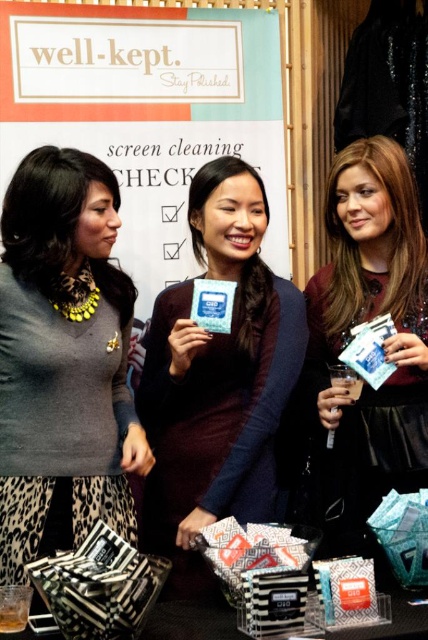
Question: Among these objects, which one is farthest from the camera?

Choices:
 (A) black striped fabric at lower left
 (B) matte blue card at center
 (C) matte black card at center

Answer: (C)

Question: Which object appears farthest from the camera in this image?

Choices:
 (A) matte blue card at center
 (B) black striped fabric at lower left
 (C) matte black card at center
 (D) matte gray sweater at center

Answer: (C)

Question: Which object appears closest to the camera in this image?

Choices:
 (A) black striped fabric at lower left
 (B) matte gray sweater at center
 (C) matte black card at center
 (D) matte blue card at center

Answer: (A)

Question: In this image, where is matte black card at center located relative to black striped fabric at lower left?

Choices:
 (A) left
 (B) right

Answer: (B)

Question: Is matte gray sweater at center in front of matte black card at center?

Choices:
 (A) no
 (B) yes

Answer: (B)

Question: Can you confirm if matte black card at center is positioned to the left of black striped fabric at lower left?

Choices:
 (A) no
 (B) yes

Answer: (A)